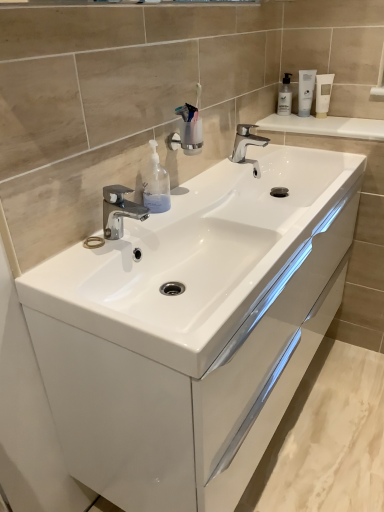
Question: From a real-world perspective, relative to polished chrome tap at center, marked as the second tap in a right-to-left arrangement, is translucent plastic soap dispenser at upper right, positioned as the 2th soap dispenser in left-to-right order, vertically above or below?

Choices:
 (A) above
 (B) below

Answer: (A)

Question: In the image, is translucent plastic soap dispenser at upper right, positioned as the 2th soap dispenser in left-to-right order, positioned in front of or behind polished chrome tap at center, arranged as the first tap when viewed from the left?

Choices:
 (A) behind
 (B) front

Answer: (A)

Question: Which object is positioned closest to the transparent plastic soap dispenser at center, the second soap dispenser from the right?

Choices:
 (A) polished chrome tap at center, the 1th tap ordered from the bottom
 (B) white glossy tube at upper right
 (C) white glossy cabinet at center
 (D) translucent plastic soap dispenser at upper right, marked as the 2th soap dispenser in a bottom-to-top arrangement
 (E) polished chrome tap at center, the first tap when ordered from back to front

Answer: (A)

Question: Which object is positioned closest to the polished chrome tap at center, which is counted as the 1th tap, starting from the right?

Choices:
 (A) translucent plastic soap dispenser at upper right, the first soap dispenser when ordered from right to left
 (B) white glossy tube at upper right
 (C) polished chrome tap at center, arranged as the first tap when viewed from the left
 (D) transparent plastic soap dispenser at center, the first soap dispenser positioned from the front
 (E) white glossy cabinet at center

Answer: (A)